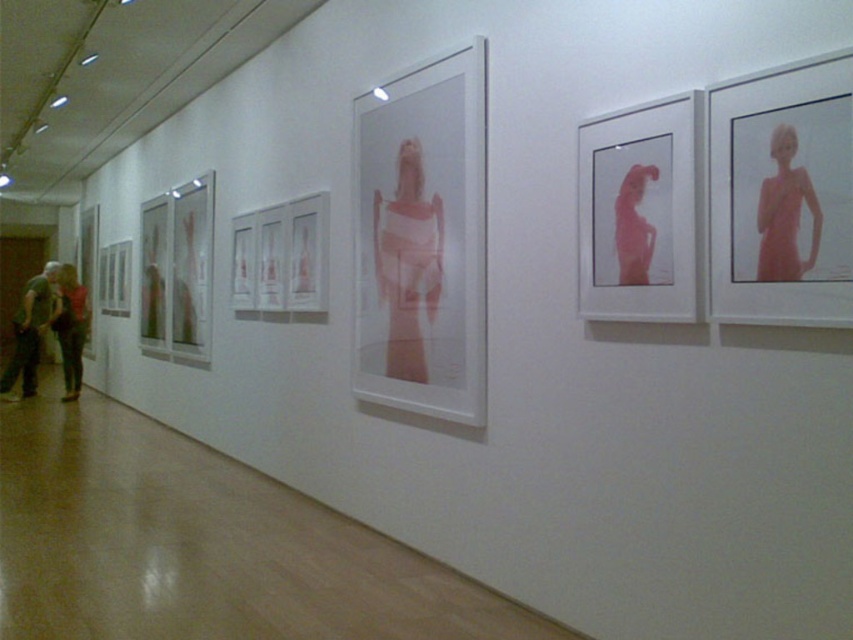
Question: Does pink matte dress at upper right appear on the left side of matte black jacket at lower left?

Choices:
 (A) no
 (B) yes

Answer: (A)

Question: Is translucent white dress at center positioned at the back of green cotton shirt at left?

Choices:
 (A) no
 (B) yes

Answer: (A)

Question: Which object is positioned farthest from the translucent white dress at center?

Choices:
 (A) matte black jacket at lower left
 (B) pink matte dress at upper right
 (C) translucent glass figure at center
 (D) pink matte dress at center

Answer: (A)

Question: Which object is farther from the camera taking this photo?

Choices:
 (A) pink matte dress at upper right
 (B) green cotton shirt at left
 (C) translucent white dress at center
 (D) pink matte dress at center

Answer: (B)

Question: Which object is positioned farthest from the pink matte dress at center?

Choices:
 (A) pink matte dress at upper right
 (B) green cotton shirt at left
 (C) translucent white dress at center

Answer: (B)

Question: Does pink matte dress at upper right have a larger size compared to green cotton shirt at left?

Choices:
 (A) yes
 (B) no

Answer: (A)